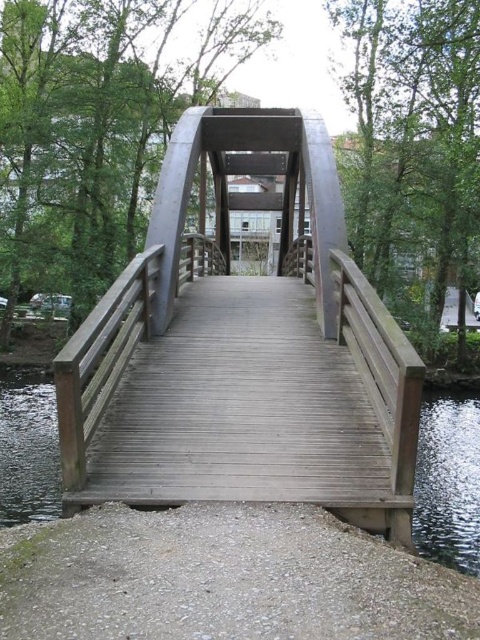
The width and height of the screenshot is (480, 640). What do you see at coordinates (243, 349) in the screenshot?
I see `wooden bridge at center` at bounding box center [243, 349].

Between wooden bridge at center and smooth gravel path at lower center, which one appears on the left side from the viewer's perspective?

From the viewer's perspective, smooth gravel path at lower center appears more on the left side.

At what (x,y) coordinates should I click in order to perform the action: click on wooden bridge at center. Please return your answer as a coordinate pair (x, y). This screenshot has height=640, width=480. Looking at the image, I should click on (243, 349).

Is point (52, 627) in front of point (425, 460)?

Yes.

Which is more to the left, smooth gravel path at lower center or clear water at bridge center?

Positioned to the left is clear water at bridge center.

What do you see at coordinates (223, 579) in the screenshot? Image resolution: width=480 pixels, height=640 pixels. I see `smooth gravel path at lower center` at bounding box center [223, 579].

The image size is (480, 640). Find the location of `smooth gravel path at lower center`. smooth gravel path at lower center is located at coordinates (x=223, y=579).

Does wooden bridge at center lie behind clear water at bridge center?

No, wooden bridge at center is in front of clear water at bridge center.

Find the location of `wooden bridge at center`. wooden bridge at center is located at coordinates (243, 349).